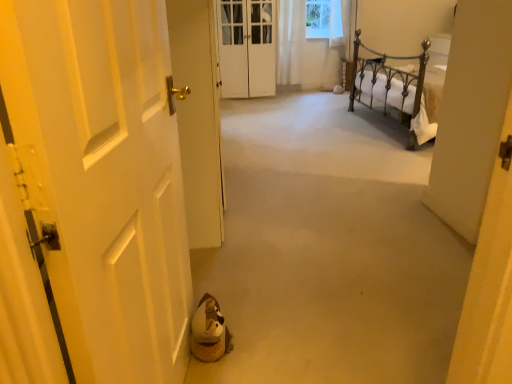
Where is `vacant space in front of white glossy door at left, positioned as the second door in back-to-front order`? The image size is (512, 384). vacant space in front of white glossy door at left, positioned as the second door in back-to-front order is located at coordinates click(290, 278).